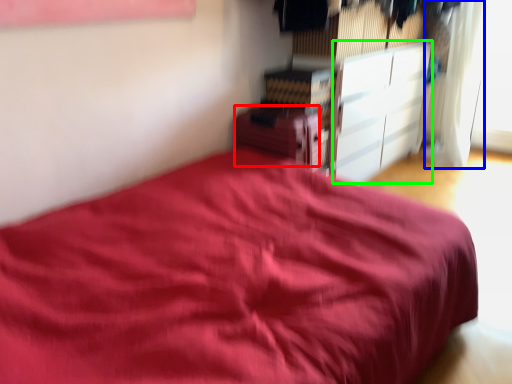
Question: Which object is positioned closest to cabinetry (highlighted by a red box)? Select from curtain (highlighted by a blue box) and cabinetry (highlighted by a green box).

Choices:
 (A) curtain
 (B) cabinetry

Answer: (B)